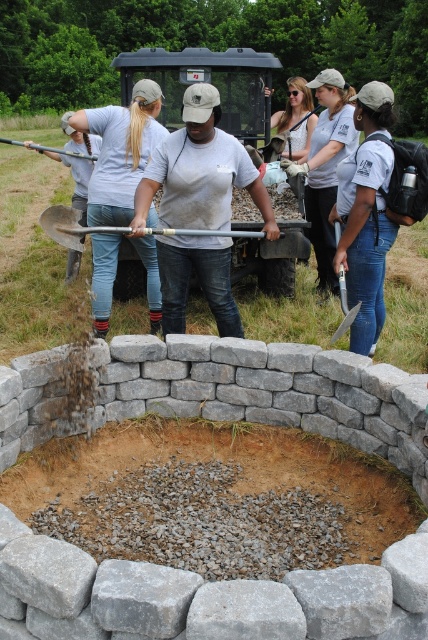
Question: Which object is closer to the camera taking this photo?

Choices:
 (A) denim jeans at center
 (B) white lace dress at center
 (C) white cotton shirt at center

Answer: (A)

Question: Is denim jeans at center closer to camera compared to white cotton shirt at center?

Choices:
 (A) no
 (B) yes

Answer: (B)

Question: Estimate the real-world distances between objects in this image. Which object is closer to the white cotton shirt at center?

Choices:
 (A) white lace dress at center
 (B) denim jeans at center

Answer: (A)

Question: Does denim jeans at center appear under white lace dress at center?

Choices:
 (A) yes
 (B) no

Answer: (A)

Question: Among these objects, which one is nearest to the camera?

Choices:
 (A) denim jeans at center
 (B) white cotton shirt at center
 (C) white lace dress at center

Answer: (A)

Question: Can you confirm if denim jeans at center is wider than white cotton shirt at center?

Choices:
 (A) yes
 (B) no

Answer: (A)